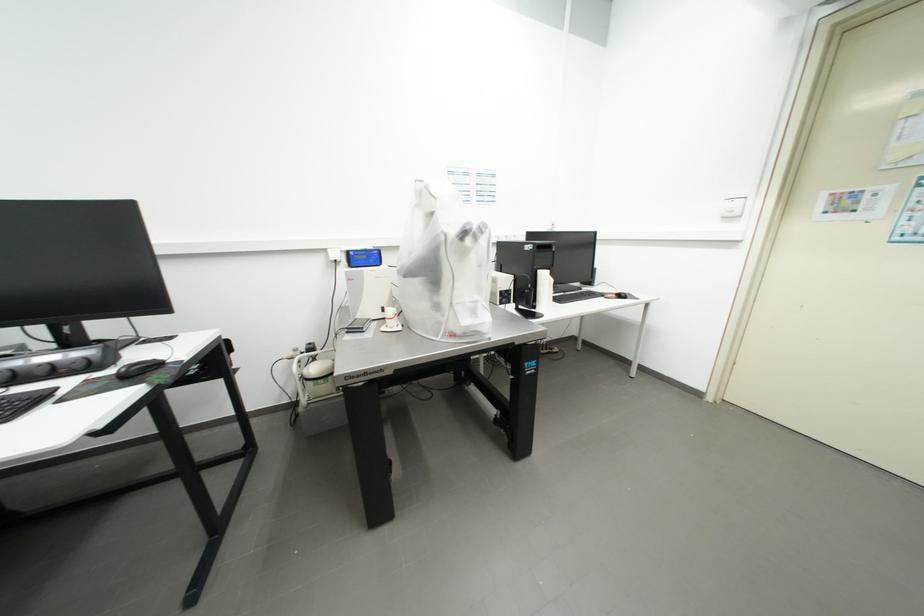
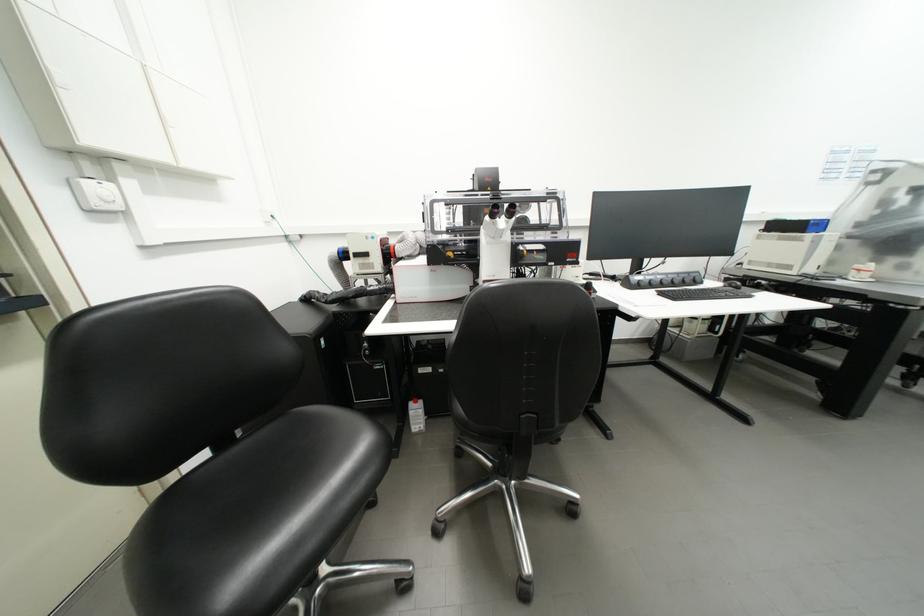
What movement of the cameraman would produce the second image?

The movement direction of the cameraman is left, backward.